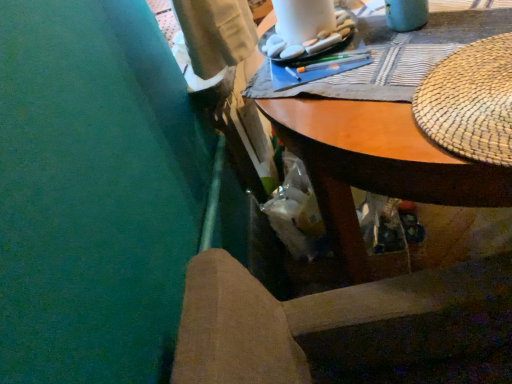
Question: Considering the positions of woven straw placemat at upper right and white matte rocks at upper center in the image, is woven straw placemat at upper right taller or shorter than white matte rocks at upper center?

Choices:
 (A) tall
 (B) short

Answer: (B)

Question: From a real-world perspective, is woven straw placemat at upper right positioned above or below white matte rocks at upper center?

Choices:
 (A) below
 (B) above

Answer: (A)

Question: Considering the real-world distances, which object is closest to the woven straw placemat at upper right?

Choices:
 (A) wooden desk at upper center
 (B) white matte rocks at upper center
 (C) wooden chair at lower center

Answer: (A)

Question: Which object is the farthest from the wooden chair at lower center?

Choices:
 (A) woven straw placemat at upper right
 (B) white matte rocks at upper center
 (C) wooden desk at upper center

Answer: (B)